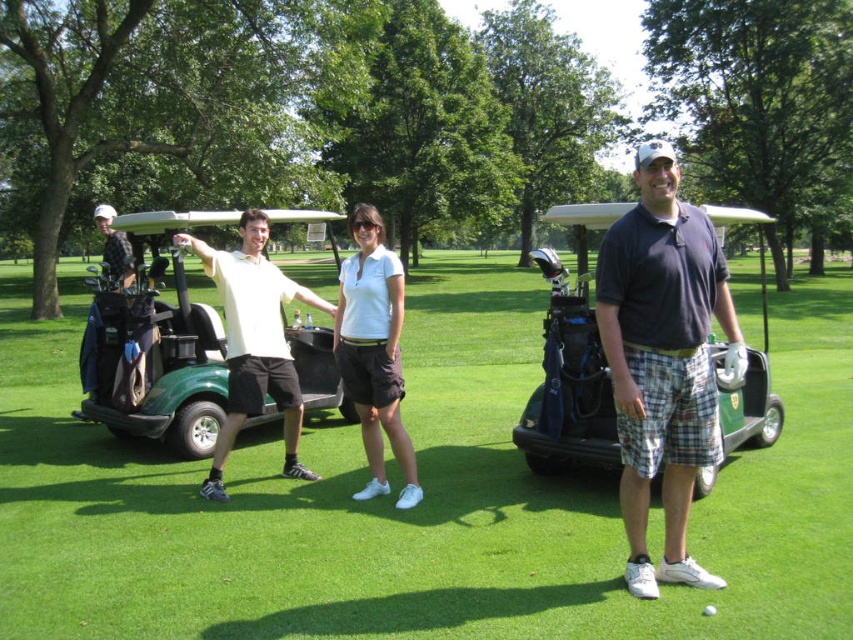
You are standing at the point labeled as point (x=183, y=401) and want to walk to the point labeled as point (x=734, y=292). Which direction should you move in to reach your destination?

You should move backward to reach point (x=734, y=292) because it is behind point (x=183, y=401).

From the picture: You are a golfer who wants to walk from the green grass at center to the green matte golf cart at left. Is the grass at center lower than the golf cart at left?

The green grass at center is shorter than the green matte golf cart at left, so yes, the grass at center is lower than the golf cart at left.